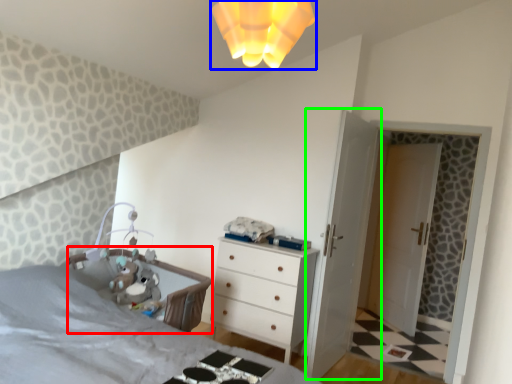
Question: Based on their relative distances, which object is nearer to infant bed (highlighted by a red box)? Choose from light fixture (highlighted by a blue box) and door (highlighted by a green box).

Choices:
 (A) light fixture
 (B) door

Answer: (B)